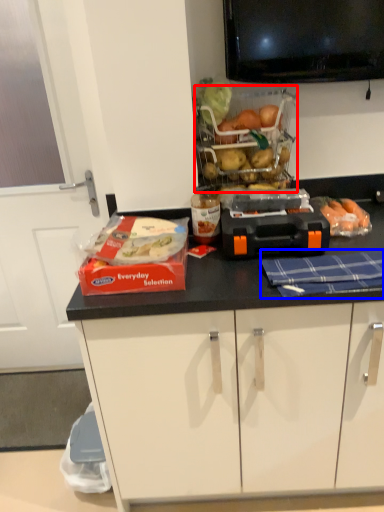
Question: Which object appears closest to the camera in this image, basket (highlighted by a red box) or blanket (highlighted by a blue box)?

Choices:
 (A) basket
 (B) blanket

Answer: (B)